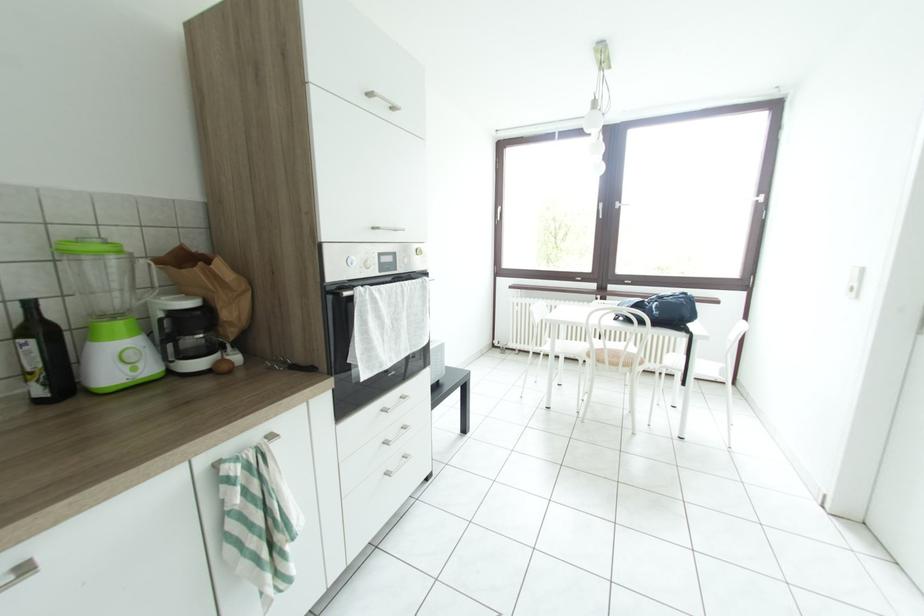
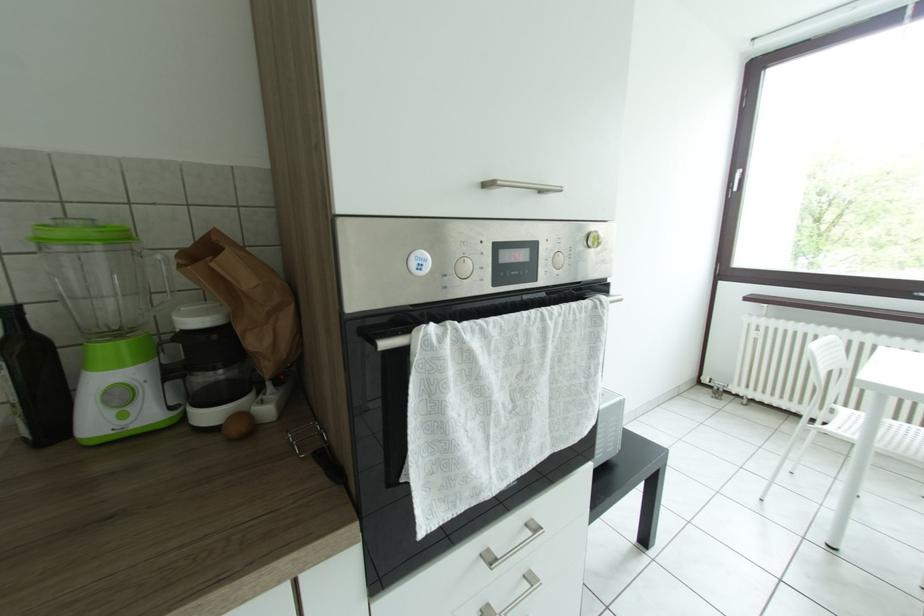
Question: Which direction would the cameraman need to move to produce the second image? Reply with the corresponding letter.

Choices:
 (A) Left
 (B) Right
 (C) Forward
 (D) Backward

Answer: (C)